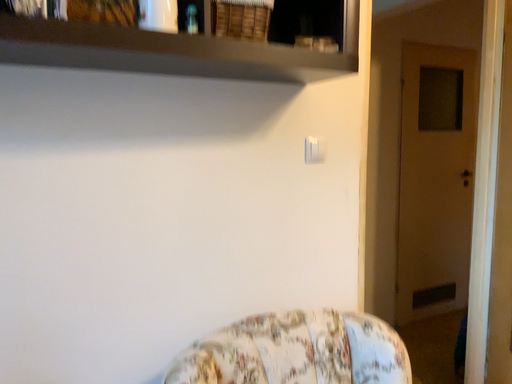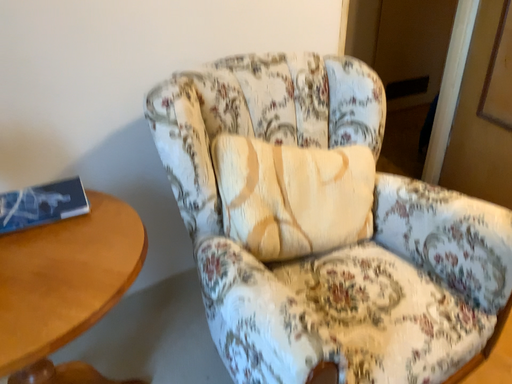
Question: Which way did the camera rotate in the video?

Choices:
 (A) rotated upward
 (B) rotated downward

Answer: (B)